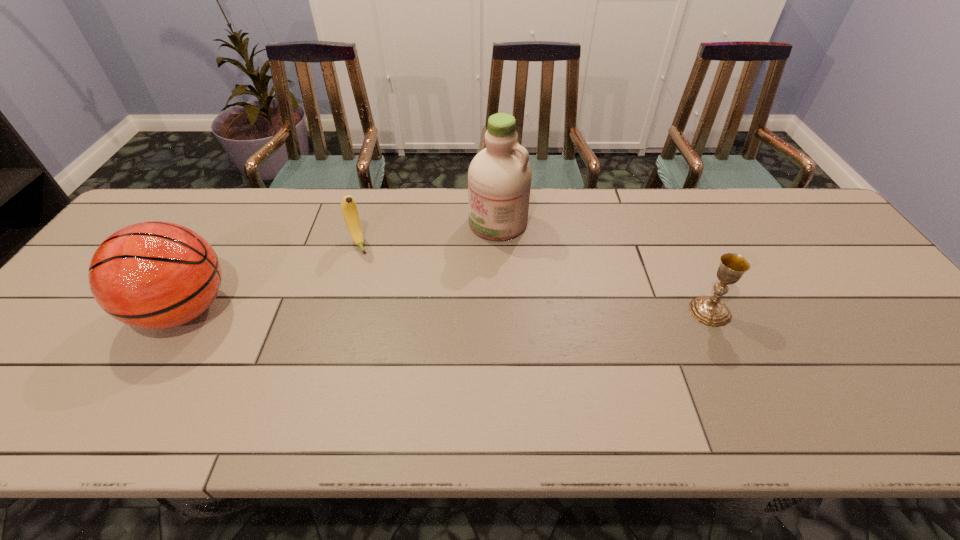
Where is `vacant space located on the front label of the cleansing agent`? This screenshot has height=540, width=960. vacant space located on the front label of the cleansing agent is located at coordinates (406, 291).

You are a GUI agent. You are given a task and a screenshot of the screen. Output one action in this format:
    pyautogui.click(x=<x>, y=<y>)
    Task: Click on the vacant space located from the stem of the third object from right to left
    Image resolution: width=960 pixels, height=540 pixels.
    Given the screenshot: What is the action you would take?
    pyautogui.click(x=389, y=312)

You are a GUI agent. You are given a task and a screenshot of the screen. Output one action in this format:
    pyautogui.click(x=<x>, y=<y>)
    Task: Click on the free space located from the stem of the third object from right to left
    
    Given the screenshot: What is the action you would take?
    pyautogui.click(x=392, y=318)

This screenshot has height=540, width=960. Identify the location of free space located from the stem of the third object from right to left. (367, 266).

Where is `cleansing agent at the far edge`? The width and height of the screenshot is (960, 540). cleansing agent at the far edge is located at coordinates (499, 177).

Image resolution: width=960 pixels, height=540 pixels. What are the coordinates of `banana positioned at the far edge` in the screenshot? It's located at (349, 209).

The height and width of the screenshot is (540, 960). In the image, there is a desktop. Find the location of `vacant region at the far edge`. vacant region at the far edge is located at coordinates (574, 191).

Locate an element on the screen. free region at the near edge of the desktop is located at coordinates (803, 365).

You are a GUI agent. You are given a task and a screenshot of the screen. Output one action in this format:
    pyautogui.click(x=<x>, y=<y>)
    Task: Click on the vacant space at the right edge of the desktop
    The image size is (960, 540).
    Given the screenshot: What is the action you would take?
    pyautogui.click(x=868, y=291)

Locate an element on the screen. This screenshot has height=540, width=960. free spot at the far left corner of the desktop is located at coordinates (157, 214).